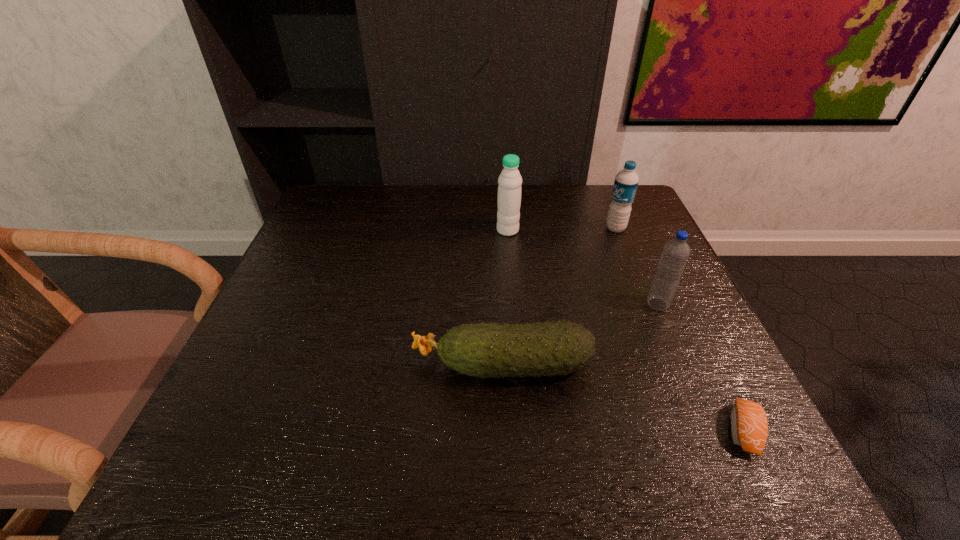
Locate an element on the screen. The height and width of the screenshot is (540, 960). vacant space that satisfies the following two spatial constraints: 1. on the front side of the third nearest object; 2. at the blossom end of the fourth tallest object is located at coordinates (684, 364).

I want to click on free space that satisfies the following two spatial constraints: 1. at the blossom end of the second nearest object; 2. on the back side of the shortest object, so click(505, 431).